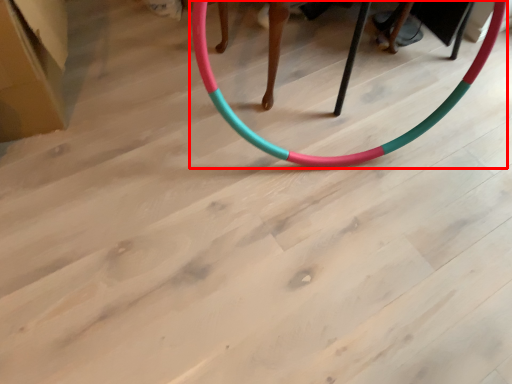
Question: From the image's perspective, where is toy (annotated by the red box) located in relation to cardboard box in the image?

Choices:
 (A) above
 (B) below

Answer: (B)